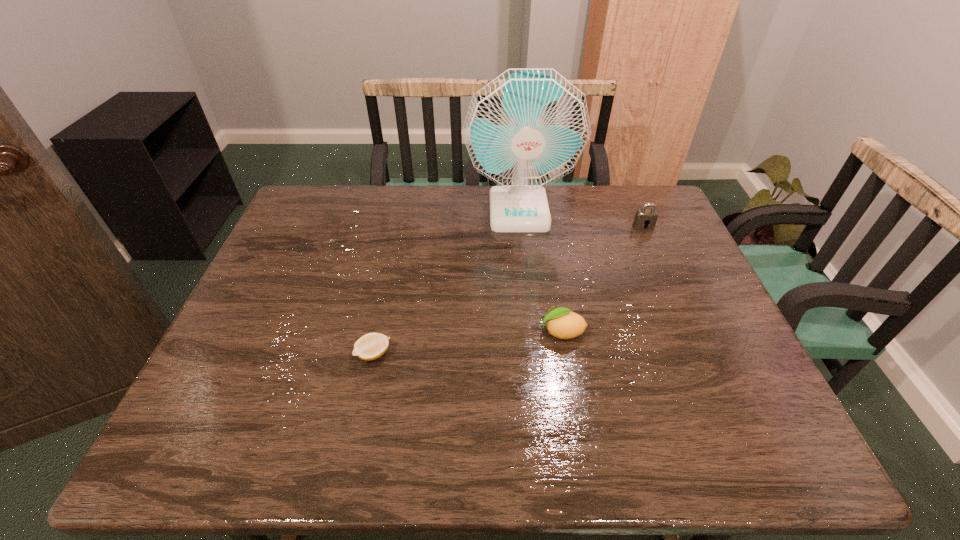
This screenshot has width=960, height=540. In order to click on vacant space at the near left corner of the desktop in this screenshot , I will do `click(210, 442)`.

At what (x,y) coordinates should I click in order to perform the action: click on unoccupied position between the tallest object and the leftmost object. Please return your answer as a coordinate pair (x, y). The image size is (960, 540). Looking at the image, I should click on (446, 282).

Locate an element on the screen. vacant point located between the fan and the padlock is located at coordinates (581, 219).

This screenshot has width=960, height=540. In order to click on empty space between the taller lemon and the fan in this screenshot , I will do `click(540, 271)`.

You are a GUI agent. You are given a task and a screenshot of the screen. Output one action in this format:
    pyautogui.click(x=<x>, y=<y>)
    Task: Click on the vacant space that is in between the right lemon and the left lemon
    
    Given the screenshot: What is the action you would take?
    pyautogui.click(x=468, y=343)

Find the location of a particular element. The height and width of the screenshot is (540, 960). free space between the padlock and the tallest object is located at coordinates (581, 219).

Identify the location of free space between the padlock and the left lemon. (509, 291).

Identify the location of unoccupied area between the fan and the right lemon. The image size is (960, 540). (540, 271).

Identify the location of vacant area between the fan and the left lemon. (446, 282).

This screenshot has width=960, height=540. In order to click on empty space that is in between the taller lemon and the rightmost object in this screenshot , I will do `click(602, 279)`.